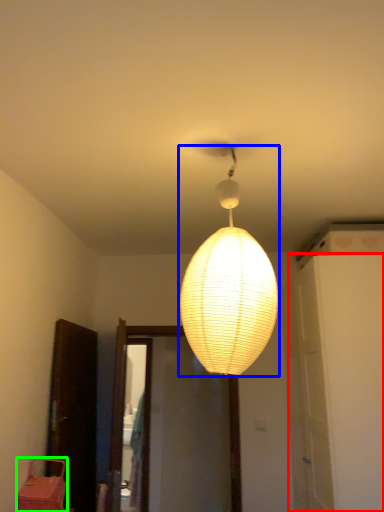
Question: Estimate the real-world distances between objects in this image. Which object is closer to door (highlighted by a red box), lamp (highlighted by a blue box) or furniture (highlighted by a green box)?

Choices:
 (A) lamp
 (B) furniture

Answer: (A)